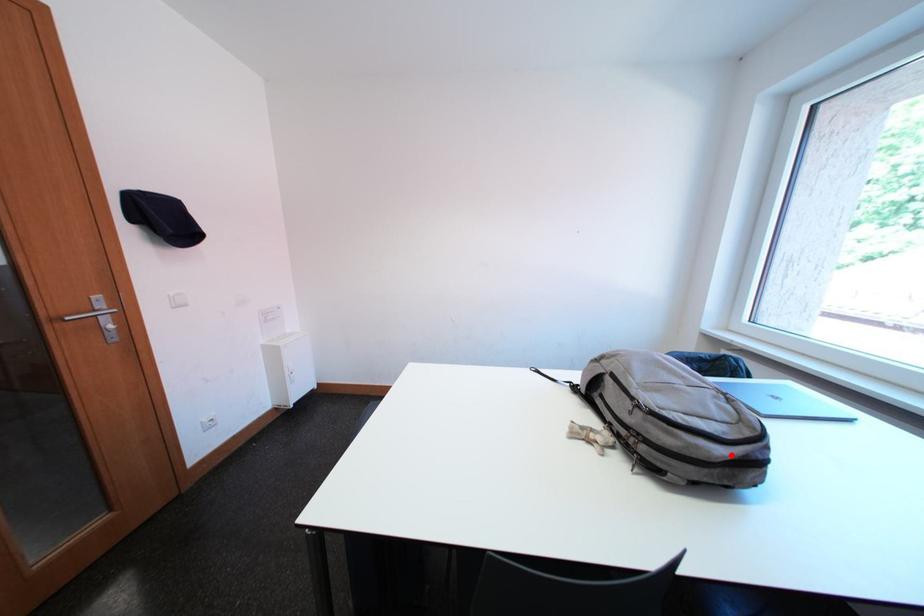
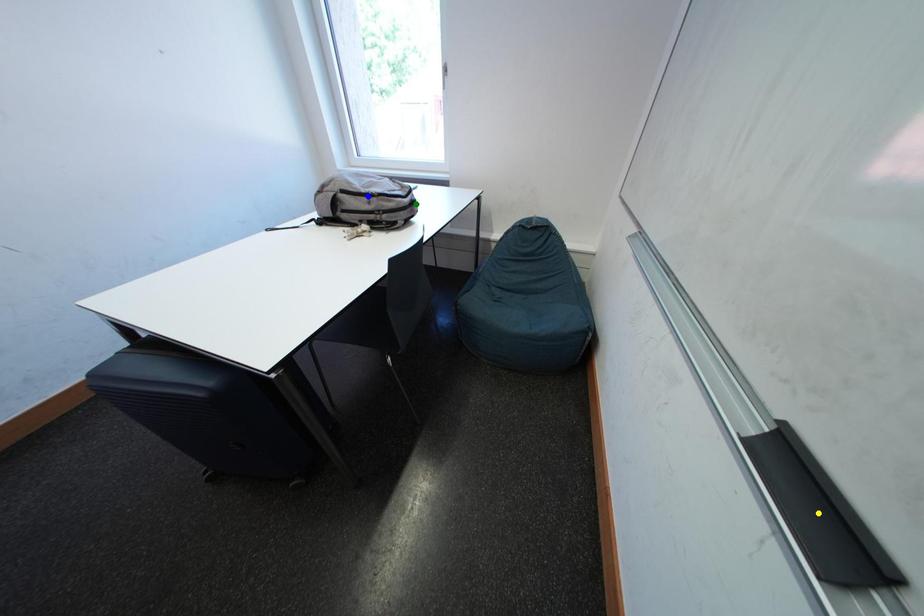
Question: I am providing you with two images of the same scene from different viewpoints. A red point is marked on the first image. You are given multiple points on the second image. Which point in image 2 represents the same 3d spot as the red point in image 1?

Choices:
 (A) blue point
 (B) green point
 (C) yellow point

Answer: (B)